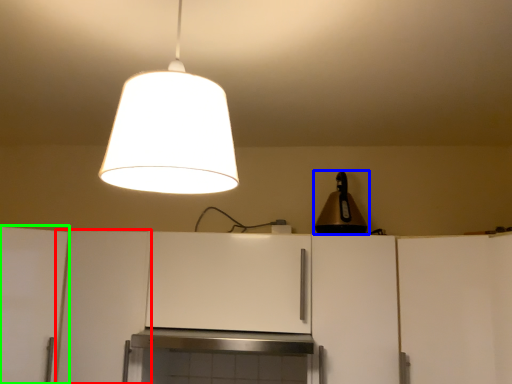
Question: Which object is the farthest from cabinetry (highlighted by a red box)? Choose among these: lamp (highlighted by a blue box) or cabinetry (highlighted by a green box).

Choices:
 (A) lamp
 (B) cabinetry

Answer: (A)